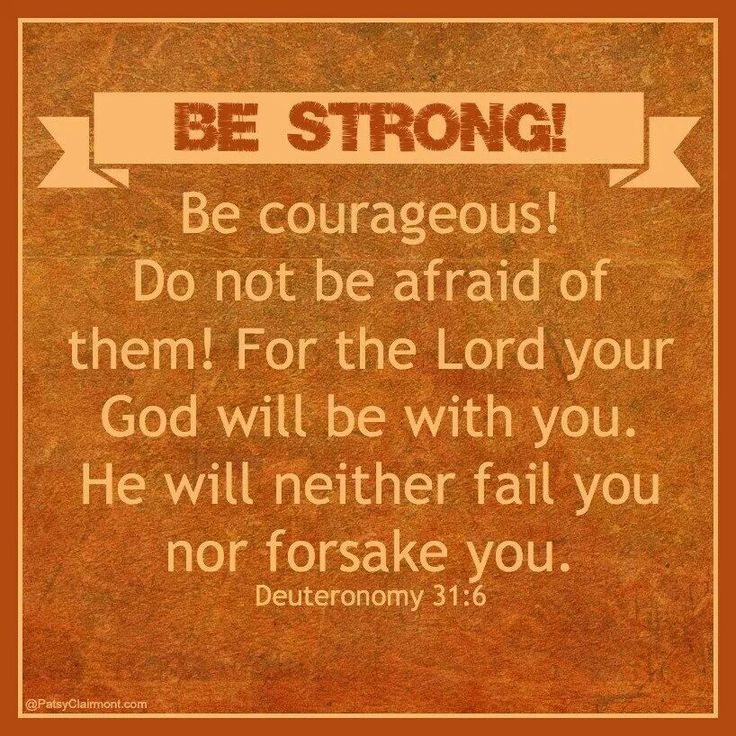
Identify the location of image canvas (color). pos(679,726), pos(13,723), pos(15,6), pos(726,17).